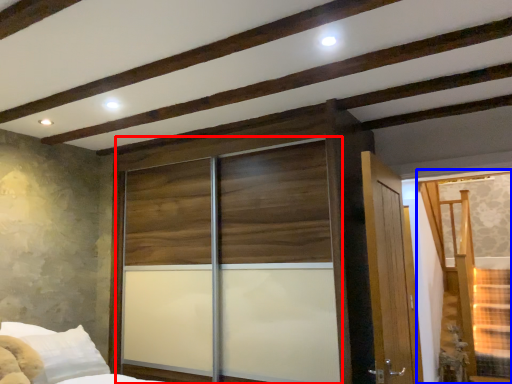
Question: Which of the following is the closest to the observer, screen door (highlighted by a red box) or window (highlighted by a blue box)?

Choices:
 (A) screen door
 (B) window

Answer: (A)